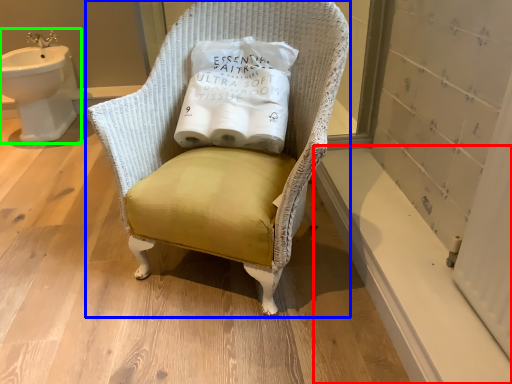
Question: Which object is the farthest from window sill (highlighted by a red box)? Choose among these: chair (highlighted by a blue box) or sink (highlighted by a green box).

Choices:
 (A) chair
 (B) sink

Answer: (B)